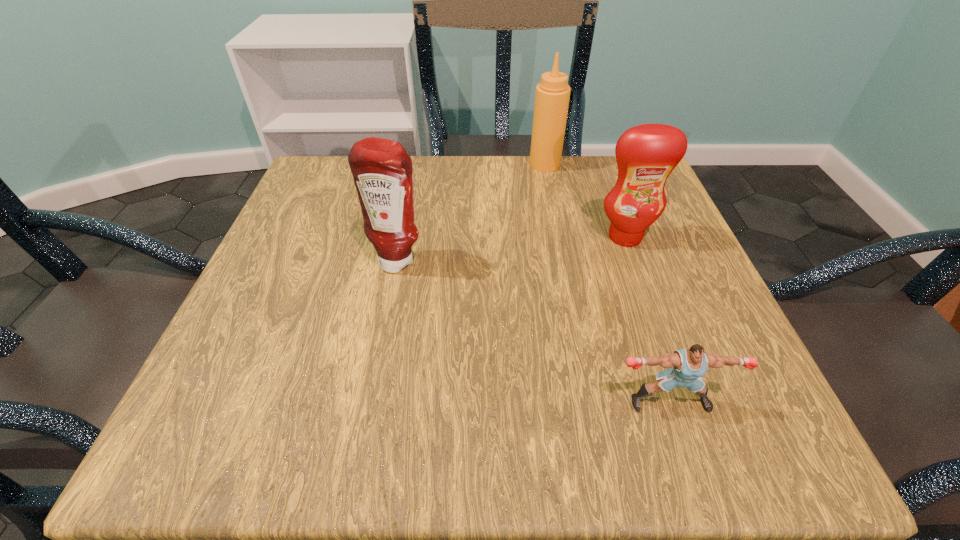
You are a GUI agent. You are given a task and a screenshot of the screen. Output one action in this format:
    pyautogui.click(x=<x>, y=<y>)
    Task: Click on the object present at the far edge
    The height and width of the screenshot is (540, 960).
    Given the screenshot: What is the action you would take?
    pyautogui.click(x=552, y=96)

You are a GUI agent. You are given a task and a screenshot of the screen. Output one action in this format:
    pyautogui.click(x=<x>, y=<y>)
    Task: Click on the object that is at the near edge
    
    Given the screenshot: What is the action you would take?
    pyautogui.click(x=687, y=366)

The width and height of the screenshot is (960, 540). I want to click on condiment located in the right edge section of the desktop, so click(646, 154).

At what (x,y) coordinates should I click in order to perform the action: click on puncher at the right edge. Please return your answer as a coordinate pair (x, y). This screenshot has height=540, width=960. Looking at the image, I should click on (687, 366).

Where is `object that is at the near right corner`? The height and width of the screenshot is (540, 960). object that is at the near right corner is located at coordinates (687, 366).

This screenshot has height=540, width=960. I want to click on blank space at the far edge of the desktop, so click(486, 193).

The image size is (960, 540). Find the location of `free space at the near edge`. free space at the near edge is located at coordinates (468, 443).

Image resolution: width=960 pixels, height=540 pixels. Find the location of `vacant position at the left edge of the desktop`. vacant position at the left edge of the desktop is located at coordinates 287,333.

Where is `vacant region at the right edge of the desktop`? The width and height of the screenshot is (960, 540). vacant region at the right edge of the desktop is located at coordinates (716, 319).

Identify the location of blank space at the far left corner. This screenshot has height=540, width=960. (330, 213).